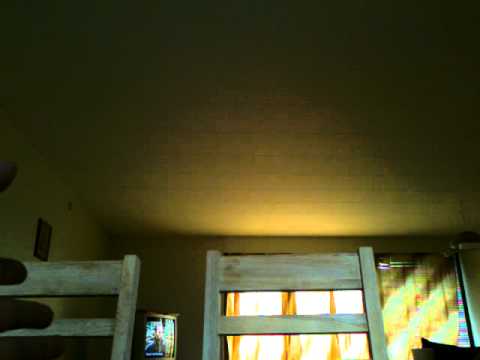
The height and width of the screenshot is (360, 480). Find the location of `ceiling`. ceiling is located at coordinates (163, 93).